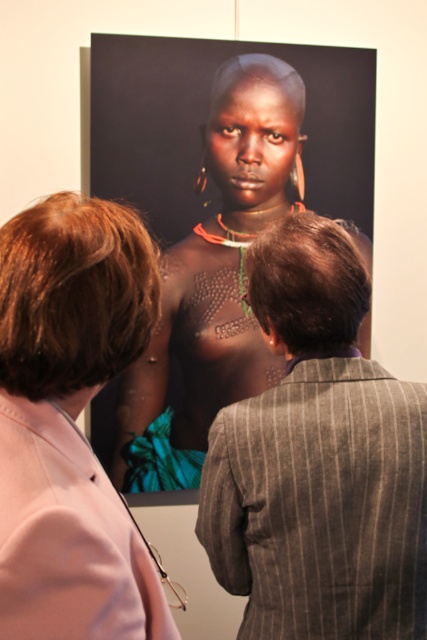
Question: Among these objects, which one is nearest to the camera?

Choices:
 (A) pink fabric at upper left
 (B) matte black skin at center
 (C) gray pinstripe suit at center

Answer: (A)

Question: Does pink fabric at upper left have a greater width compared to matte black skin at center?

Choices:
 (A) yes
 (B) no

Answer: (B)

Question: Which is farther from the pink fabric at upper left?

Choices:
 (A) gray pinstripe suit at center
 (B) matte black skin at center

Answer: (B)

Question: Which of the following is the closest to the observer?

Choices:
 (A) gray pinstripe suit at center
 (B) pink fabric at upper left

Answer: (B)

Question: From the image, what is the correct spatial relationship of pink fabric at upper left in relation to matte black skin at center?

Choices:
 (A) above
 (B) below

Answer: (B)

Question: Is gray pinstripe suit at center below matte black skin at center?

Choices:
 (A) no
 (B) yes

Answer: (B)